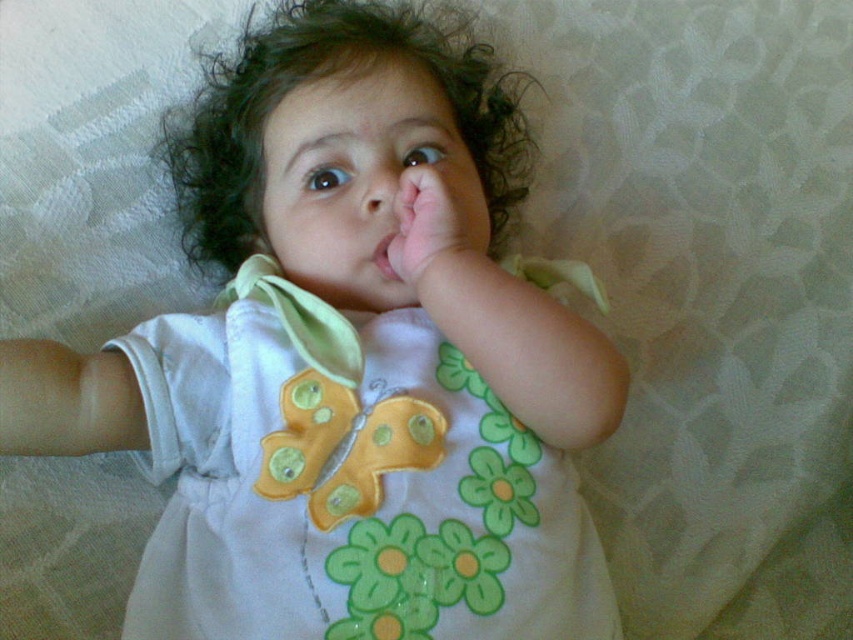
In the image, there is a child lying down with a pink smooth hand at center and a smooth skin nose at center. Which object is located to the right of the other?

The pink smooth hand at center is positioned on the right side of the smooth skin nose at center.

The child in the image has a pink smooth hand at center and a smooth skin nose at center. Which one is shorter in height?

The pink smooth hand at center is shorter in height compared to the smooth skin nose at center.

A child is lying on a bed. There are two points marked on the bed. The first point is at coordinates point A at (231, 595). The second point is at point B at 0.567, 0.821. The distance between them is 67.77 centimeters. If the child wants to place a small toy at point A and another at point B, will the toys be more than 60 centimeters apart?

The distance between point A at (231, 595) and point B at 0.567, 0.821 is 67.77 centimeters. Since 67.77 centimeters is greater than 60 centimeters, the toys will be more than 60 centimeters apart.